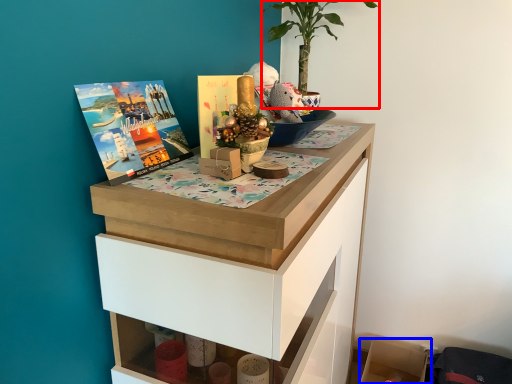
Question: Which of the following is the farthest to the observer, houseplant (highlighted by a red box) or shelf (highlighted by a blue box)?

Choices:
 (A) houseplant
 (B) shelf

Answer: (B)